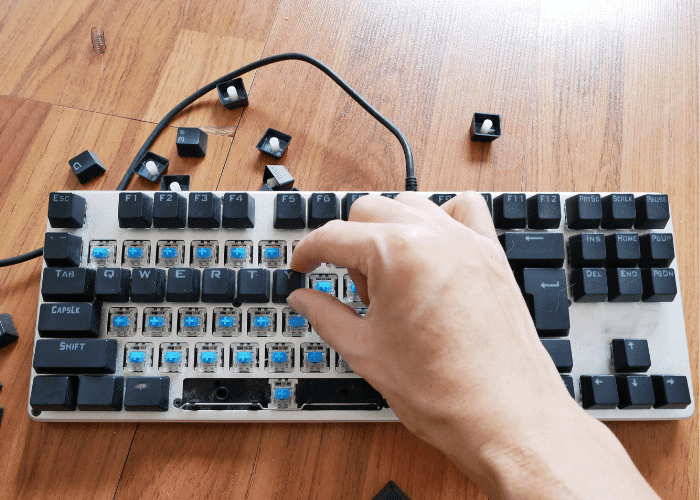
The image size is (700, 500). Identify the location of desk. (182, 470).